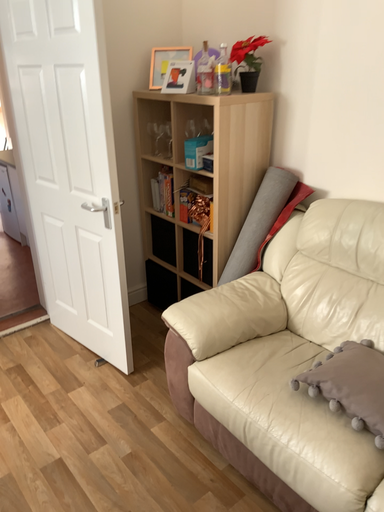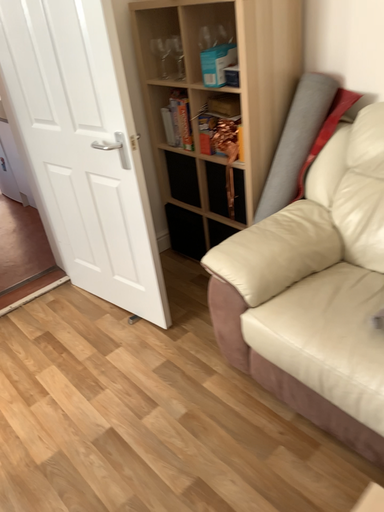
Question: Which way did the camera rotate in the video?

Choices:
 (A) rotated upward
 (B) rotated downward

Answer: (B)